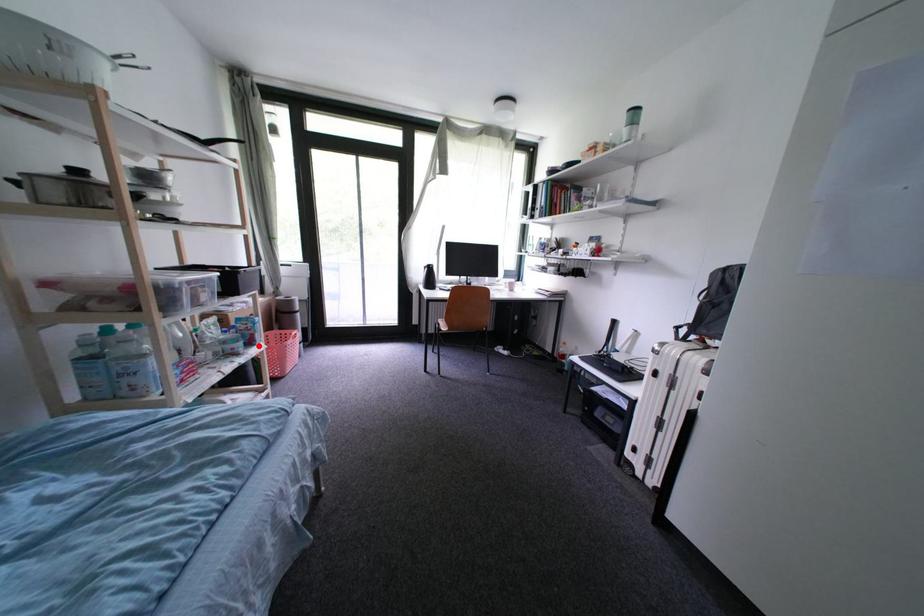
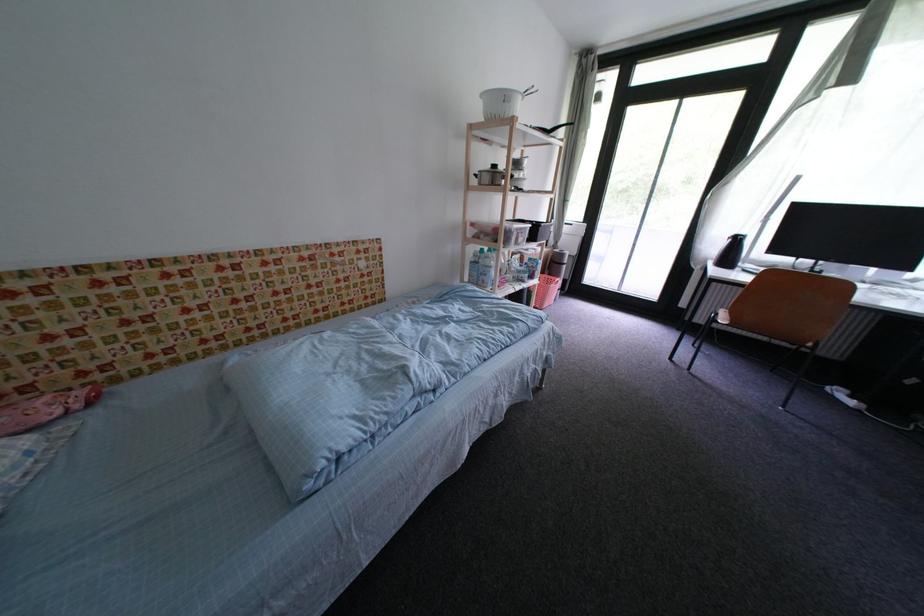
Question: I am providing you with two images of the same scene from different viewpoints. A red point is shown in image1. For the corresponding object point in image2, is it positioned nearer or farther from the camera?

Choices:
 (A) Nearer
 (B) Farther

Answer: (B)